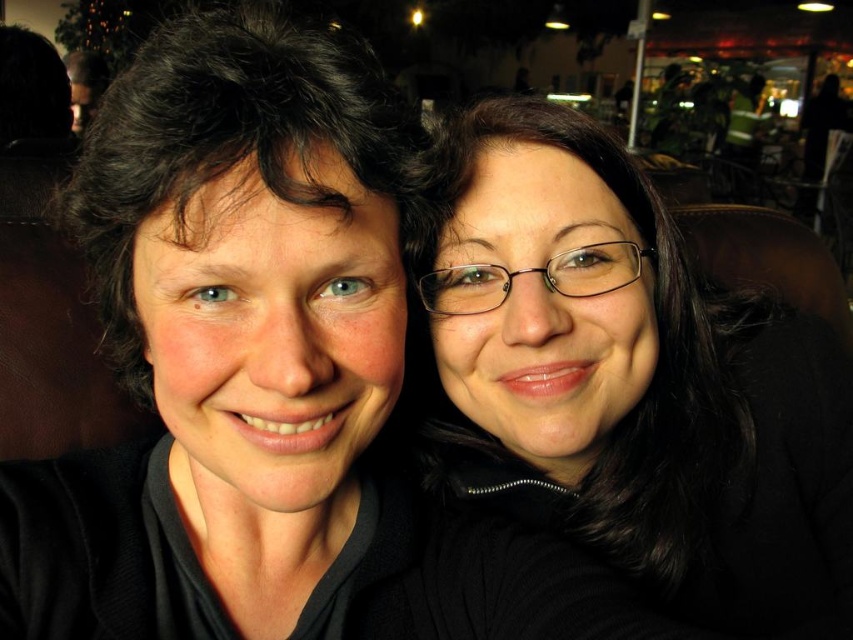
Based on the photo, can you confirm if matte black hair at left is thinner than black matte glasses at upper right?

Yes.

Is matte black hair at left to the left of black matte glasses at upper right from the viewer's perspective?

Indeed, matte black hair at left is positioned on the left side of black matte glasses at upper right.

The width and height of the screenshot is (853, 640). Find the location of `matte black hair at left`. matte black hair at left is located at coordinates (227, 342).

This screenshot has width=853, height=640. I want to click on matte black hair at left, so click(227, 342).